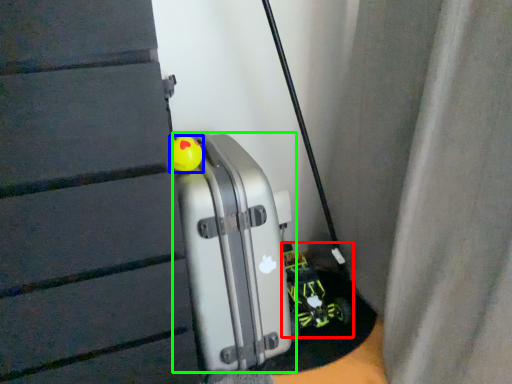
Question: Considering the real-world distances, which object is closest to toy car (highlighted by a red box)? toy (highlighted by a blue box) or luggage (highlighted by a green box).

Choices:
 (A) toy
 (B) luggage

Answer: (B)